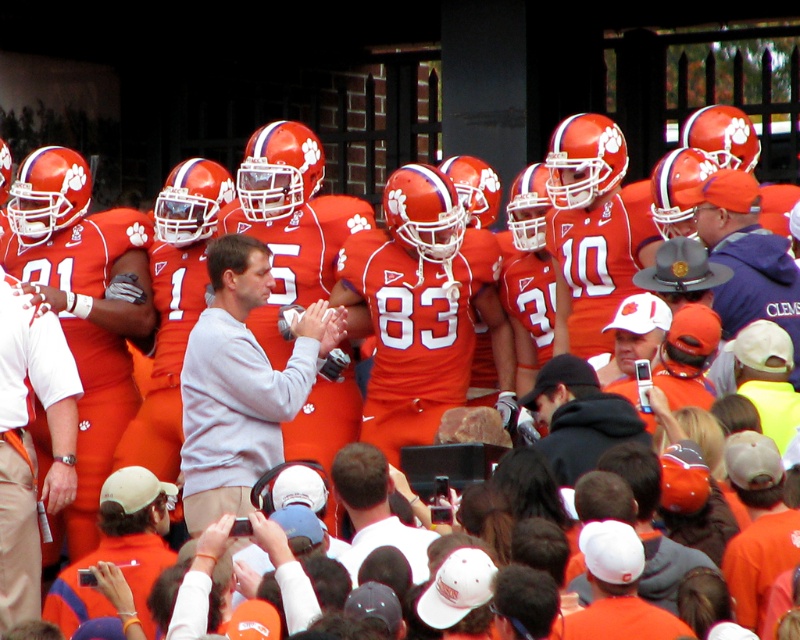
You are a photographer standing at the edge of the field. You want to take a photo of the white matte cap at center and the gray sweatshirt at center. Which object should you focus on first to ensure it appears sharp in the photo?

The gray sweatshirt at center should be focused on first because it is closer to you than the white matte cap at center, which is behind it.

You are a photographer at the football game and want to capture a photo of both the orange jersey at lower left and the black hoodie at center. Which object should you zoom in on to make the smaller one appear larger in the photo?

The orange jersey at lower left is not as tall as the black hoodie at center, so you should zoom in on the orange jersey at lower left to make it appear larger in the photo.

You are a photographer at the football game and want to take a photo of the gray sweatshirt at center and the white matte cap at center. Which object should you pan your camera to the right to include in the frame first?

The gray sweatshirt at center is to the left of the white matte cap at center, so you should pan your camera to the right to include the white matte cap at center first.